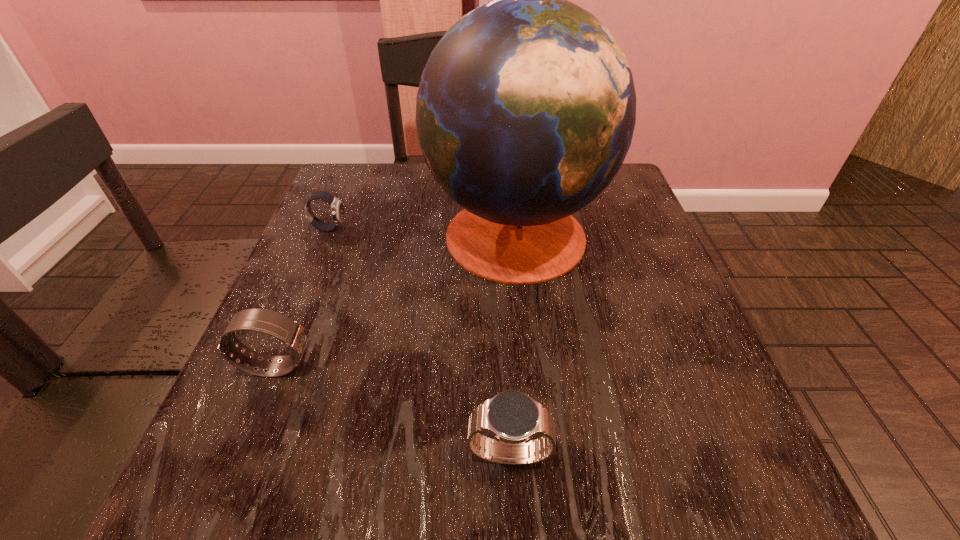
Where is `free location that satisfies the following two spatial constraints: 1. on the face of the shortest watch; 2. on the left side of the nearest object`? Image resolution: width=960 pixels, height=540 pixels. free location that satisfies the following two spatial constraints: 1. on the face of the shortest watch; 2. on the left side of the nearest object is located at coordinates (235, 454).